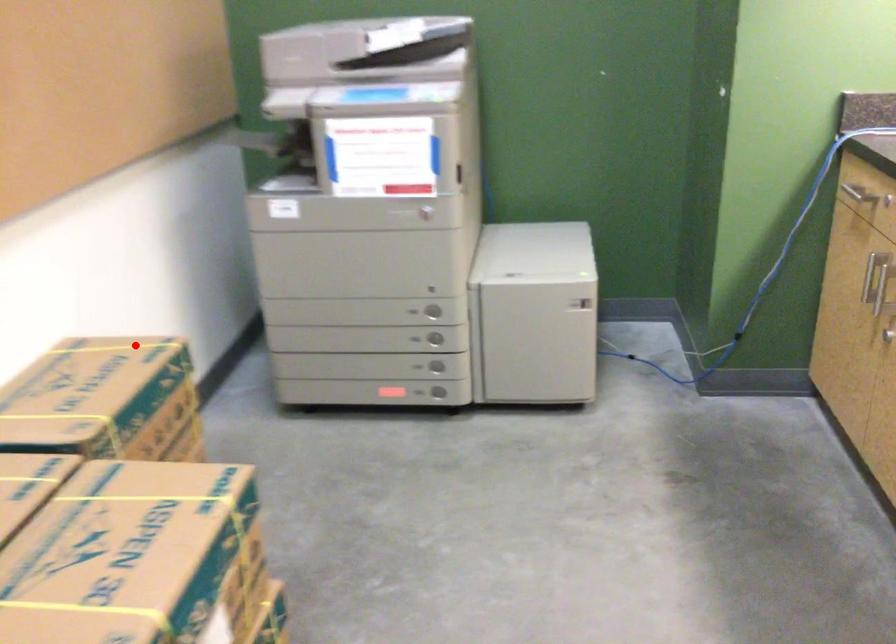
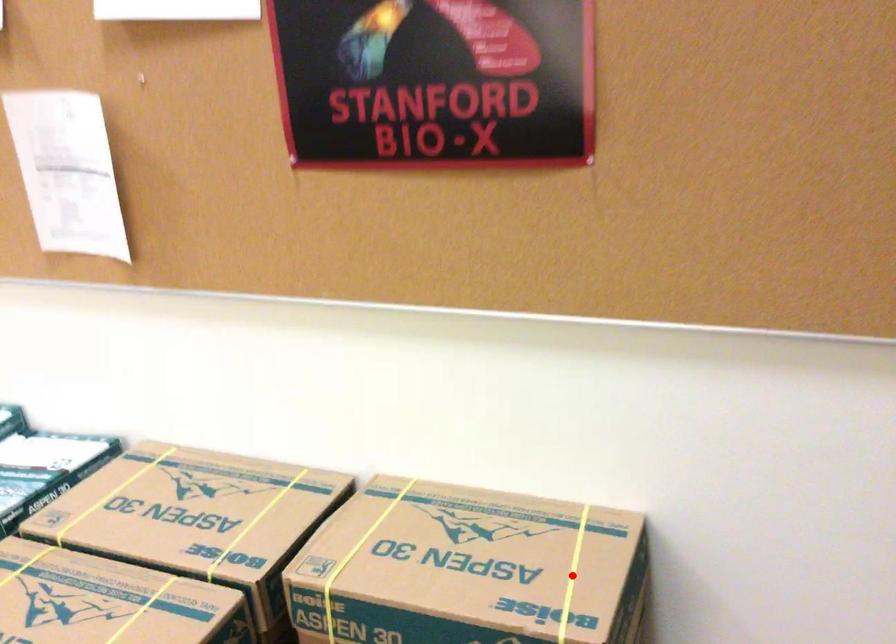
I am providing you with two images of the same scene from different viewpoints. A red point is marked on the first image and another point is marked on the second image. Is the marked point in image1 the same physical position as the marked point in image2?

Yes